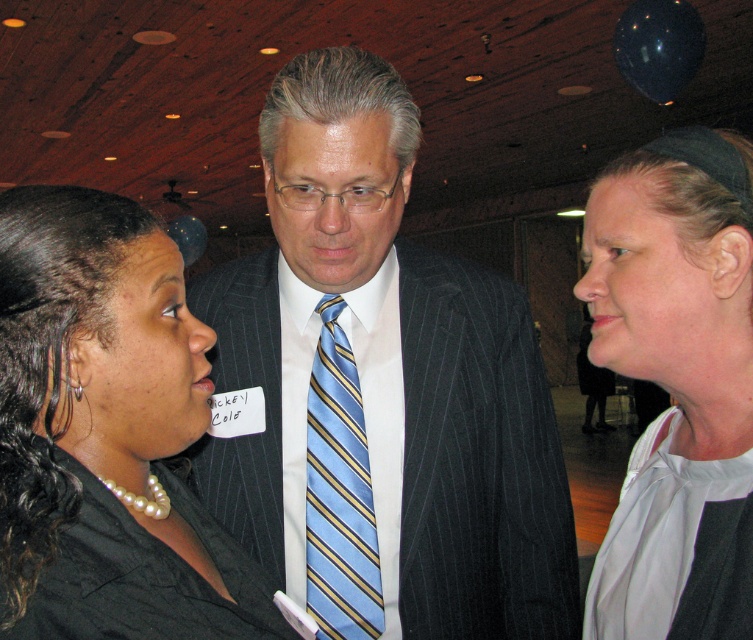
Question: Which point is farther from the camera taking this photo?

Choices:
 (A) (248, 310)
 (B) (2, 221)
 (C) (361, 586)

Answer: (A)

Question: Is dark gray pinstripe suit at center above white fabric at center?

Choices:
 (A) yes
 (B) no

Answer: (B)

Question: Which of these objects is positioned farthest from the blue striped tie at center?

Choices:
 (A) black satin blazer at center
 (B) dark gray pinstripe suit at center
 (C) white fabric at center

Answer: (C)

Question: Considering the relative positions of black satin blazer at center and white fabric at center in the image provided, where is black satin blazer at center located with respect to white fabric at center?

Choices:
 (A) left
 (B) right

Answer: (A)

Question: Which point is closer to the camera?

Choices:
 (A) dark gray pinstripe suit at center
 (B) blue striped tie at center
 (C) white fabric at center
 (D) black satin blazer at center

Answer: (D)

Question: Can you confirm if white fabric at center is positioned above blue striped tie at center?

Choices:
 (A) no
 (B) yes

Answer: (B)